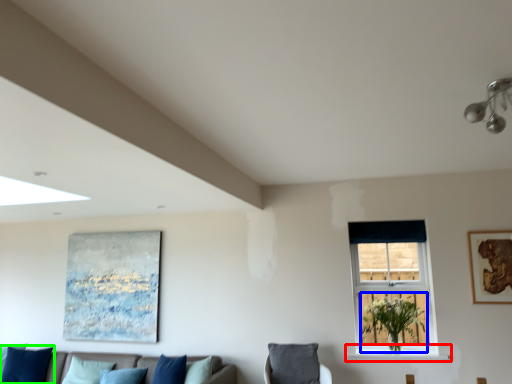
Question: Which is nearer to the window sill (highlighted by a red box)? plant (highlighted by a blue box) or pillow (highlighted by a green box).

Choices:
 (A) plant
 (B) pillow

Answer: (A)